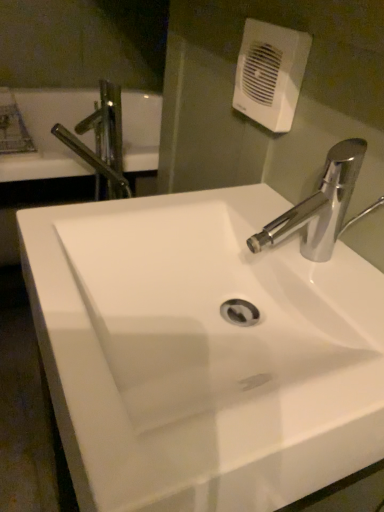
Question: Should I look upward or downward to see white glossy sink at center?

Choices:
 (A) up
 (B) down

Answer: (B)

Question: Is metallic chrome tap at upper left shorter than white plastic hand dryer at upper center?

Choices:
 (A) yes
 (B) no

Answer: (B)

Question: Can you confirm if metallic chrome tap at upper left is positioned to the right of white plastic hand dryer at upper center?

Choices:
 (A) yes
 (B) no

Answer: (B)

Question: Considering the relative sizes of metallic chrome tap at upper left and white plastic hand dryer at upper center in the image provided, is metallic chrome tap at upper left thinner than white plastic hand dryer at upper center?

Choices:
 (A) no
 (B) yes

Answer: (A)

Question: Is metallic chrome tap at upper left oriented towards white plastic hand dryer at upper center?

Choices:
 (A) yes
 (B) no

Answer: (B)

Question: Does metallic chrome tap at upper left have a greater height compared to white plastic hand dryer at upper center?

Choices:
 (A) no
 (B) yes

Answer: (B)

Question: Considering the relative positions of metallic chrome tap at upper left and white plastic hand dryer at upper center in the image provided, is metallic chrome tap at upper left to the left of white plastic hand dryer at upper center from the viewer's perspective?

Choices:
 (A) yes
 (B) no

Answer: (A)

Question: Does white glossy sink at center have a smaller size compared to white plastic hand dryer at upper center?

Choices:
 (A) yes
 (B) no

Answer: (B)

Question: Can you confirm if white glossy sink at center is bigger than white plastic hand dryer at upper center?

Choices:
 (A) no
 (B) yes

Answer: (B)

Question: Considering the relative sizes of white glossy sink at center and white plastic hand dryer at upper center in the image provided, is white glossy sink at center wider than white plastic hand dryer at upper center?

Choices:
 (A) no
 (B) yes

Answer: (B)

Question: Does white glossy sink at center have a greater height compared to white plastic hand dryer at upper center?

Choices:
 (A) no
 (B) yes

Answer: (B)

Question: From a real-world perspective, is white glossy sink at center over white plastic hand dryer at upper center?

Choices:
 (A) yes
 (B) no

Answer: (B)

Question: From the image's perspective, is white glossy sink at center below white plastic hand dryer at upper center?

Choices:
 (A) yes
 (B) no

Answer: (A)

Question: Is metallic chrome tap at upper left a part of white plastic hand dryer at upper center?

Choices:
 (A) yes
 (B) no

Answer: (B)